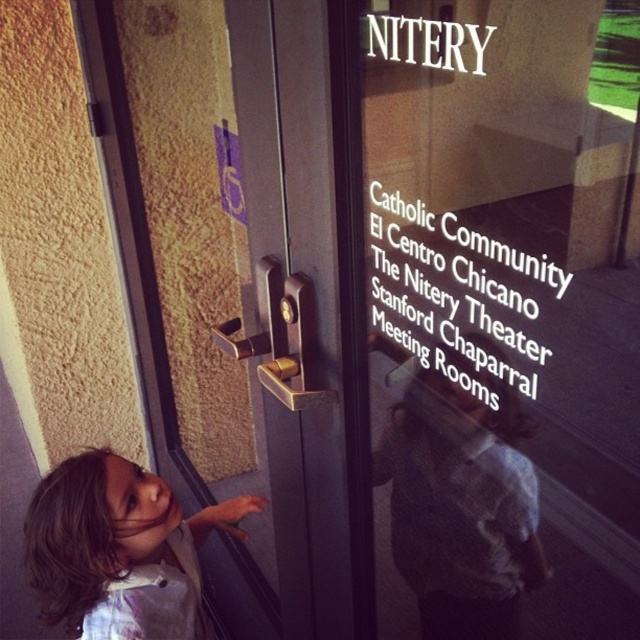
You are standing in front of the transparent glass door at center and notice the brown hair at lower left. Which object is taller?

The transparent glass door at center is taller than the brown hair at lower left.